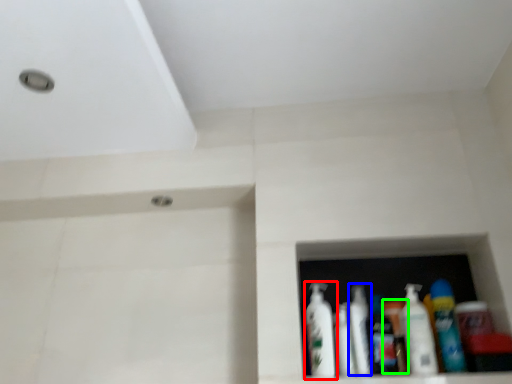
Question: Considering the real-world distances, which object is farthest from bottle (highlighted by a red box)? mouthwash (highlighted by a blue box) or toiletry (highlighted by a green box)?

Choices:
 (A) mouthwash
 (B) toiletry

Answer: (B)